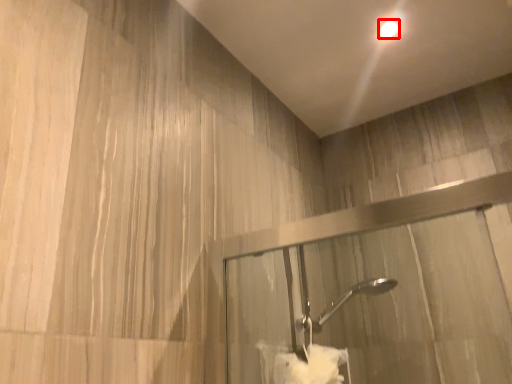
Question: From the image's perspective, what is the correct spatial relationship of droplight (annotated by the red box) in relation to bath towel?

Choices:
 (A) below
 (B) above

Answer: (B)